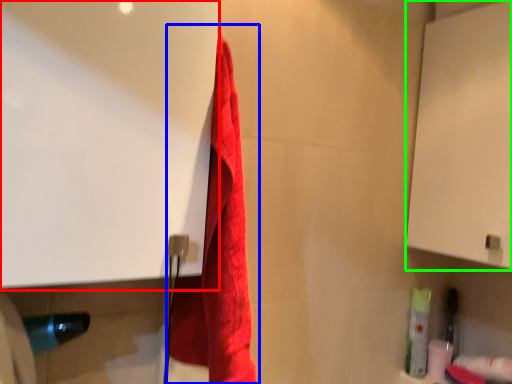
Question: Which object is the farthest from screen door (highlighted by a red box)? Choose among these: towel (highlighted by a blue box) or screen door (highlighted by a green box).

Choices:
 (A) towel
 (B) screen door

Answer: (B)